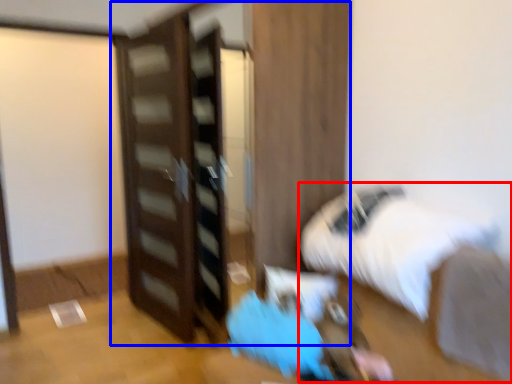
Question: Among these objects, which one is farthest to the camera, bed (highlighted by a red box) or dresser (highlighted by a blue box)?

Choices:
 (A) bed
 (B) dresser

Answer: (B)